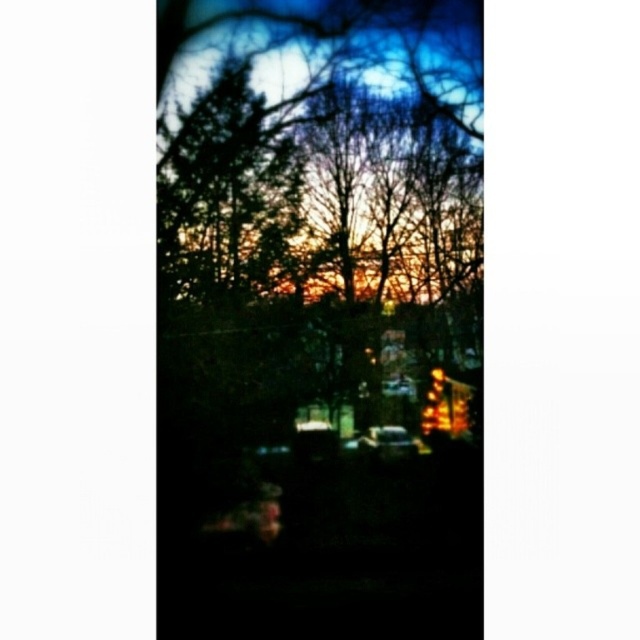
From the picture: You are standing in the evening scene and want to walk from the point at coordinates point (273, 172) to the point at coordinates point (397, 449). Which direction should you move to get closer to your destination?

To move from point (273, 172) to point (397, 449), you should move towards the lower right direction since point (273, 172) is closer to the camera and point (397, 449) is further away in the lower right area of the image.

You are driving a shiny silver car at center and want to exit the forest area. The silhouetted bare branches at center are blocking your path. Can you drive under them without damaging the car?

The silhouetted bare branches at center are positioned over the shiny silver car at center. Since the branches are above the car, you can drive under them safely without causing damage.